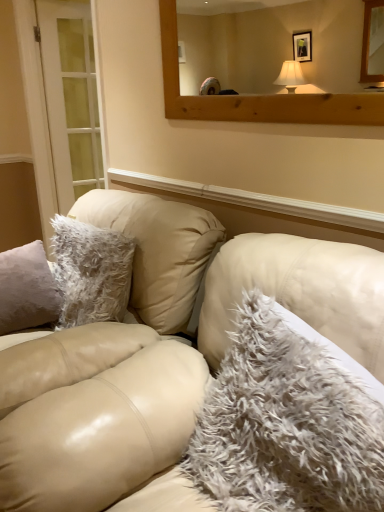
The image size is (384, 512). What do you see at coordinates (71, 99) in the screenshot? I see `white glass door at left` at bounding box center [71, 99].

Where is `leather couch at center`? The image size is (384, 512). leather couch at center is located at coordinates (161, 372).

From a real-world perspective, is leather couch at center positioned above or below white glass door at left?

In terms of real-world spatial position, leather couch at center is below white glass door at left.

At what (x,y) coordinates should I click in order to perform the action: click on glass door that appears behind the leather couch at center. Please return your answer as a coordinate pair (x, y). This screenshot has height=512, width=384. Looking at the image, I should click on (71, 99).

In the scene shown: Would you say leather couch at center is outside white glass door at left?

leather couch at center lies outside white glass door at left's area.

From the image's perspective, is leather couch at center above white glass door at left?

No, from the image's perspective, leather couch at center is not on top of white glass door at left.

Could you tell me if leather couch at center is facing fuzzy white pillow at center?

Yes, leather couch at center faces towards fuzzy white pillow at center.

Is leather couch at center further to the viewer compared to fuzzy white pillow at center?

That is False.

From a real-world perspective, is leather couch at center on fuzzy white pillow at center?

No, from a real-world perspective, leather couch at center is not over fuzzy white pillow at center

Considering the relative sizes of leather couch at center and fuzzy white pillow at center in the image provided, is leather couch at center taller than fuzzy white pillow at center?

Yes, leather couch at center is taller than fuzzy white pillow at center.

You are a GUI agent. You are given a task and a screenshot of the screen. Output one action in this format:
    pyautogui.click(x=<x>, y=<y>)
    Task: Click on the mirror behind the fuzzy white pillow at center
    
    Given the screenshot: What is the action you would take?
    pyautogui.click(x=257, y=96)

Considering the positions of objects fuzzy white pillow at center and wooden mirror at upper center in the image provided, who is more to the right, fuzzy white pillow at center or wooden mirror at upper center?

fuzzy white pillow at center.

Measure the distance between fuzzy white pillow at center and wooden mirror at upper center.

They are 33.32 inches apart.

Does white glass door at left have a lesser height compared to wooden mirror at upper center?

No.

Which is behind, white glass door at left or wooden mirror at upper center?

white glass door at left is behind.

Is white glass door at left bigger than wooden mirror at upper center?

Yes, white glass door at left is bigger than wooden mirror at upper center.

Considering the points (69, 141) and (279, 102), which point is behind, point (69, 141) or point (279, 102)?

The point (69, 141) is behind.

Between point (358, 96) and point (69, 191), which one is positioned in front?

The point (358, 96) is in front.

In terms of height, does wooden mirror at upper center look taller or shorter compared to white glass door at left?

Clearly, wooden mirror at upper center is shorter compared to white glass door at left.

Is there a large distance between wooden mirror at upper center and white glass door at left?

Yes, wooden mirror at upper center and white glass door at left are located far from each other.

Identify the location of glass door lying behind the wooden mirror at upper center. The width and height of the screenshot is (384, 512). (71, 99).

Based on the photo, who is taller, wooden mirror at upper center or leather couch at center?

Standing taller between the two is leather couch at center.

Relative to leather couch at center, is wooden mirror at upper center in front or behind?

Clearly, wooden mirror at upper center is behind leather couch at center.

Is wooden mirror at upper center not close to leather couch at center?

That's not correct — wooden mirror at upper center is a little close to leather couch at center.

Is wooden mirror at upper center wider than leather couch at center?

No, wooden mirror at upper center is not wider than leather couch at center.

Is white glass door at left not within fuzzy white pillow at center?

Yes, white glass door at left is not within fuzzy white pillow at center.

Is white glass door at left to the left of fuzzy white pillow at center from the viewer's perspective?

Yes.

Is white glass door at left turned away from fuzzy white pillow at center?

No.

Where is `glass door on the left of fuzzy white pillow at center`? The image size is (384, 512). glass door on the left of fuzzy white pillow at center is located at coordinates (71, 99).

Identify the location of glass door above the leather couch at center (from the image's perspective). The image size is (384, 512). (71, 99).

Where is `studio couch in front of the fuzzy white pillow at center`? This screenshot has height=512, width=384. studio couch in front of the fuzzy white pillow at center is located at coordinates (161, 372).

Which object lies further to the anchor point leather couch at center, white glass door at left or wooden mirror at upper center?

white glass door at left lies further to leather couch at center than the other object.

Based on their spatial positions, is white glass door at left or fuzzy white pillow at center closer to leather couch at center?

fuzzy white pillow at center.

Looking at the image, which one is located closer to leather couch at center, wooden mirror at upper center or white glass door at left?

wooden mirror at upper center is closer to leather couch at center.

Looking at this image, based on their spatial positions, is leather couch at center or white glass door at left closer to wooden mirror at upper center?

leather couch at center lies closer to wooden mirror at upper center than the other object.

From the image, which object appears to be farther from white glass door at left, leather couch at center or fuzzy white pillow at center?

fuzzy white pillow at center.

Looking at this image, considering their positions, is leather couch at center positioned further to white glass door at left than wooden mirror at upper center?

The object further to white glass door at left is leather couch at center.

Estimate the real-world distances between objects in this image. Which object is further from wooden mirror at upper center, fuzzy white pillow at center or leather couch at center?

fuzzy white pillow at center lies further to wooden mirror at upper center than the other object.

When comparing their distances from white glass door at left, does wooden mirror at upper center or leather couch at center seem closer?

Among the two, wooden mirror at upper center is located nearer to white glass door at left.

Identify the location of pillow positioned between leather couch at center and white glass door at left from near to far. (285, 425).

Locate an element on the screen. This screenshot has width=384, height=512. mirror between fuzzy white pillow at center and white glass door at left along the z-axis is located at coordinates (257, 96).

This screenshot has width=384, height=512. Identify the location of pillow between wooden mirror at upper center and leather couch at center in the up-down direction. (285, 425).

The image size is (384, 512). What are the coordinates of `mirror between leather couch at center and white glass door at left in the front-back direction` in the screenshot? It's located at (257, 96).